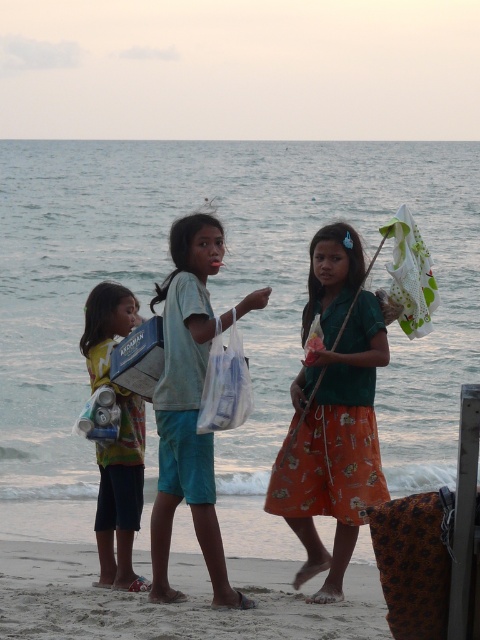
You are a photographer trying to capture a photo of the green cotton shirt at center and the sandy beach at lower center in the same frame. The camera you are using has a minimum focusing distance of 1.5 meters. Will you be able to take the photo without moving closer?

The green cotton shirt at center and the sandy beach at lower center are 1.88 meters apart from each other. Since the minimum focusing distance is 1.5 meters, you can take the photo without moving closer because the distance between them is greater than the required minimum focusing distance.